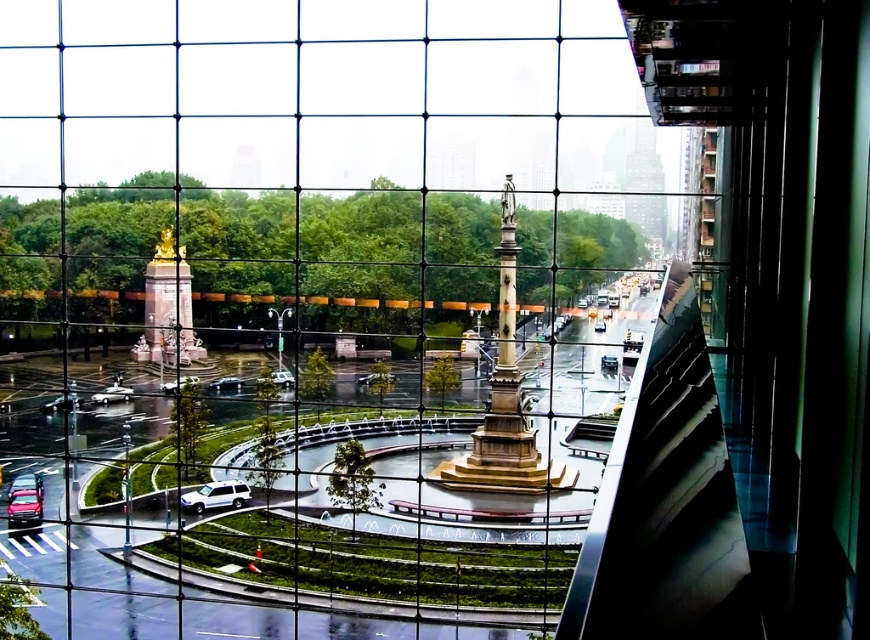
Who is positioned more to the right, silver metallic sedan at center or satin silver sedan at center?

Positioned to the right is satin silver sedan at center.

Is point (238, 378) positioned before point (599, 321)?

Yes, it is in front of point (599, 321).

Does point (231, 388) come in front of point (600, 330)?

Yes, point (231, 388) is closer to viewer.

Where is `silver metallic sedan at center`? silver metallic sedan at center is located at coordinates (225, 384).

Is point (357, 380) in front of point (182, 381)?

That is False.

Measure the distance between shiny silver car at center and shiny silver sedan at center.

The distance of shiny silver car at center from shiny silver sedan at center is 23.39 meters.

Who is more distant from viewer, (380,374) or (166,388)?

Positioned behind is point (166,388).

I want to click on shiny silver car at center, so click(375, 378).

Can you confirm if gold polished statue at center-left is thinner than silver metallic car at center?

No, gold polished statue at center-left is not thinner than silver metallic car at center.

Does gold polished statue at center-left have a greater width compared to silver metallic car at center?

Yes.

The height and width of the screenshot is (640, 870). Identify the location of gold polished statue at center-left. (166, 308).

This screenshot has height=640, width=870. Find the location of `gold polished statue at center-left`. gold polished statue at center-left is located at coordinates (166, 308).